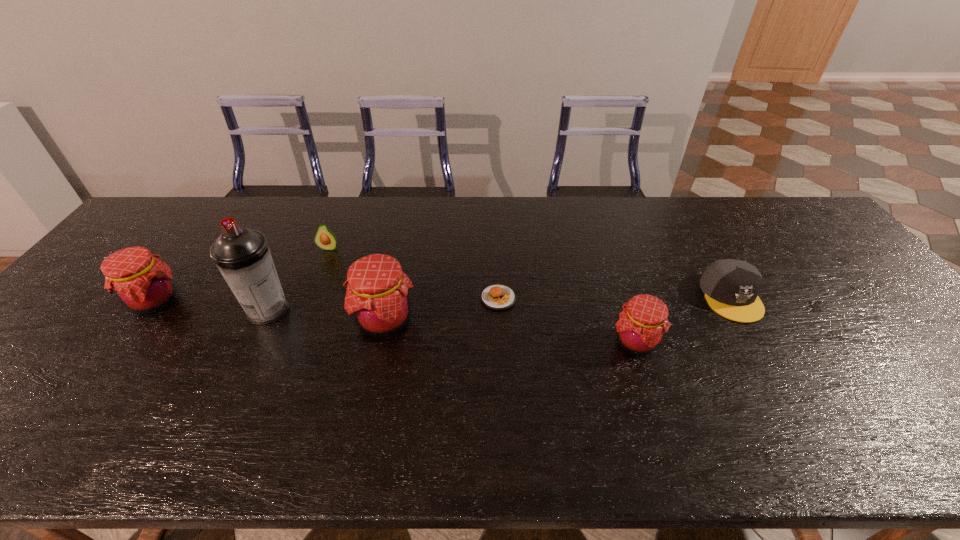
In the image, there is a desktop. Identify the location of vacant space at the far edge. (639, 197).

The image size is (960, 540). I want to click on vacant space at the near edge of the desktop, so pos(218,393).

Find the location of a particular element. The image size is (960, 540). vacant region at the left edge is located at coordinates (89, 314).

In the image, there is a desktop. Where is `vacant space at the right edge`? The image size is (960, 540). vacant space at the right edge is located at coordinates pyautogui.click(x=877, y=325).

I want to click on vacant point located between the third object from right to left and the fifth object from right to left, so click(x=414, y=273).

The image size is (960, 540). Find the location of `vacant region between the fourth object from left to right and the second object from left to right`. vacant region between the fourth object from left to right and the second object from left to right is located at coordinates (326, 315).

At what (x,y) coordinates should I click in order to perform the action: click on free space between the second tallest jam and the third object from right to left. Please return your answer as a coordinate pair (x, y). This screenshot has width=960, height=540. Looking at the image, I should click on (x=326, y=300).

You are a GUI agent. You are given a task and a screenshot of the screen. Output one action in this format:
    pyautogui.click(x=<x>, y=<y>)
    Task: Click on the vacant space that is in between the rightmost jam and the shortest object
    The height and width of the screenshot is (540, 960).
    Given the screenshot: What is the action you would take?
    pyautogui.click(x=567, y=320)

This screenshot has width=960, height=540. Identify the location of unoccupied position between the food and the fourth object from right to left. (442, 309).

Find the location of a particular element. The width and height of the screenshot is (960, 540). free spot between the cap and the sixth object from left to right is located at coordinates (684, 319).